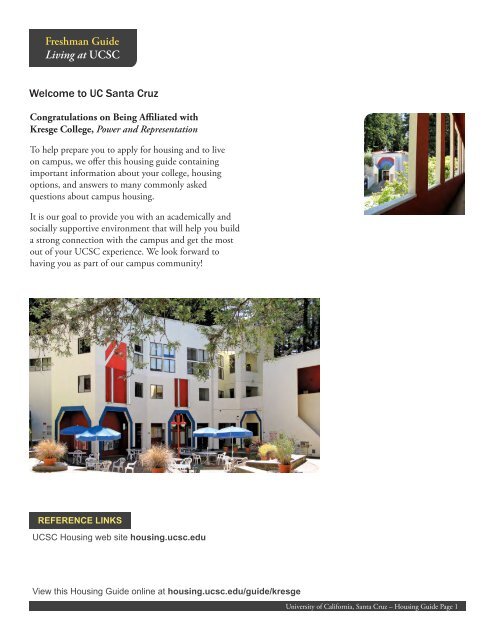
Find the location of a particular element. Image resolution: width=495 pixels, height=640 pixels. doors is located at coordinates (248, 394), (250, 365), (201, 441), (223, 443).